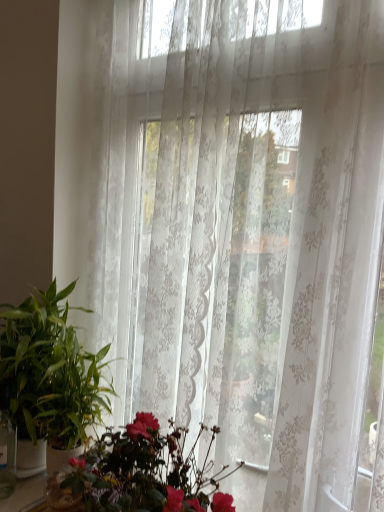
Image resolution: width=384 pixels, height=512 pixels. Describe the element at coordinates (51, 372) in the screenshot. I see `green glossy plant at left` at that location.

Locate an element on the screen. Image resolution: width=384 pixels, height=512 pixels. green glossy plant at left is located at coordinates (51, 372).

I want to click on green glossy plant at left, so click(x=51, y=372).